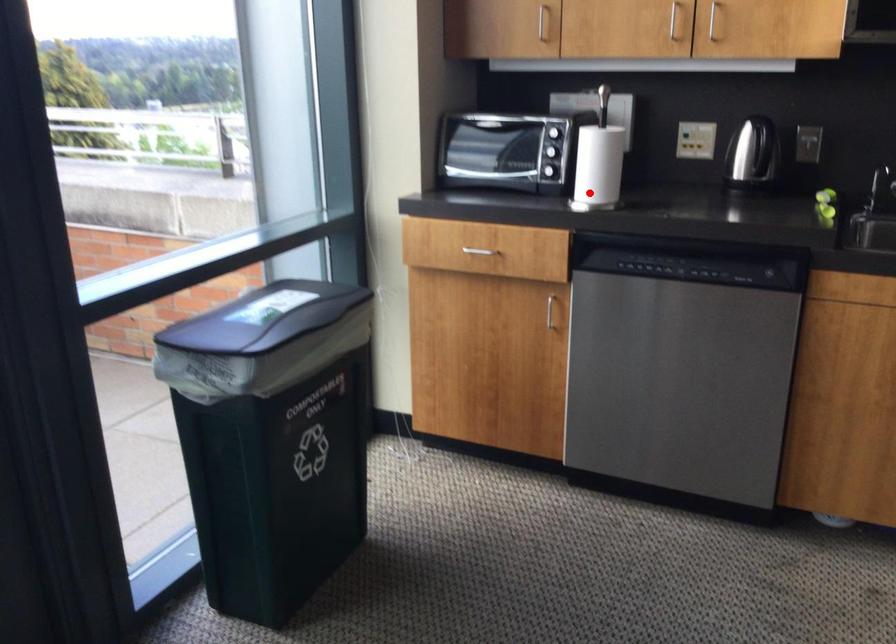
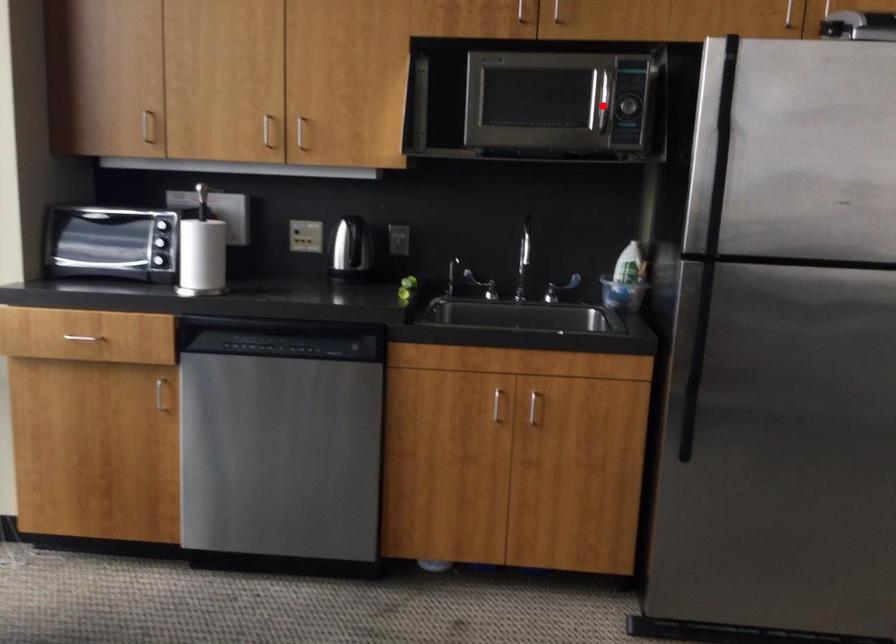
I am providing you with two images of the same scene from different viewpoints. A red point is marked on the first image and another point is marked on the second image. Do the highlighted points in image1 and image2 indicate the same real-world spot?

No